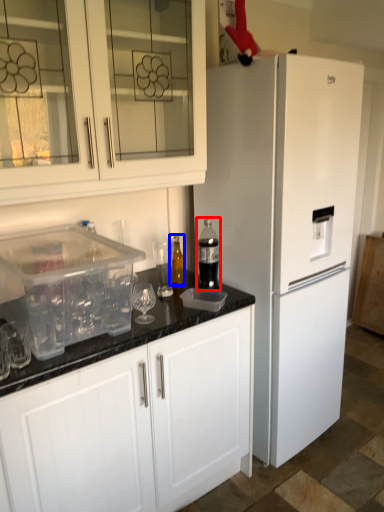
Question: Among these objects, which one is farthest to the camera, bottle (highlighted by a red box) or bottle (highlighted by a blue box)?

Choices:
 (A) bottle
 (B) bottle

Answer: (B)